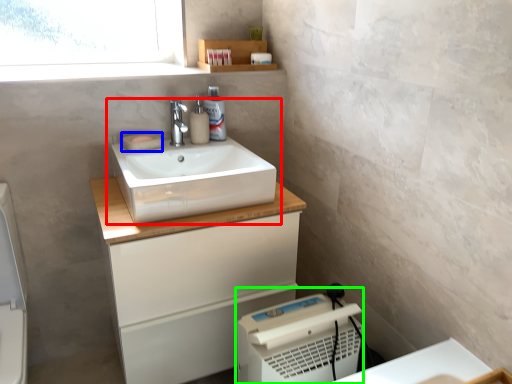
Question: Which is farther away from sink (highlighted by a red box)? soap (highlighted by a blue box) or appliance (highlighted by a green box)?

Choices:
 (A) soap
 (B) appliance

Answer: (B)